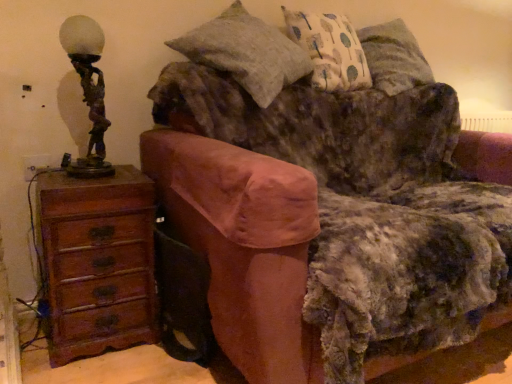
Question: From a real-world perspective, is bronze statue at left positioned over velvet brown couch at center based on gravity?

Choices:
 (A) no
 (B) yes

Answer: (B)

Question: Is bronze statue at left at the left side of velvet brown couch at center?

Choices:
 (A) no
 (B) yes

Answer: (B)

Question: Considering the relative sizes of bronze statue at left and velvet brown couch at center in the image provided, is bronze statue at left thinner than velvet brown couch at center?

Choices:
 (A) yes
 (B) no

Answer: (A)

Question: Are bronze statue at left and velvet brown couch at center located far from each other?

Choices:
 (A) no
 (B) yes

Answer: (A)

Question: Is bronze statue at left oriented towards velvet brown couch at center?

Choices:
 (A) yes
 (B) no

Answer: (B)

Question: Would you say textured gray pillow at upper center, the 2th pillow when ordered from right to left, is to the left or to the right of velvet brown couch at center in the picture?

Choices:
 (A) left
 (B) right

Answer: (A)

Question: Based on their sizes in the image, would you say textured gray pillow at upper center, the 1th pillow positioned from the left, is bigger or smaller than velvet brown couch at center?

Choices:
 (A) small
 (B) big

Answer: (A)

Question: Is point (275, 77) closer or farther from the camera than point (425, 286)?

Choices:
 (A) closer
 (B) farther

Answer: (B)

Question: From a real-world perspective, is textured gray pillow at upper center, the 1th pillow positioned from the left, positioned above or below velvet brown couch at center?

Choices:
 (A) above
 (B) below

Answer: (A)

Question: Is patterned fabric pillow at upper right, acting as the 2th pillow starting from the left, spatially inside bronze statue at left, or outside of it?

Choices:
 (A) inside
 (B) outside

Answer: (B)

Question: Based on their sizes in the image, would you say patterned fabric pillow at upper right, acting as the 2th pillow starting from the left, is bigger or smaller than bronze statue at left?

Choices:
 (A) small
 (B) big

Answer: (B)

Question: Considering the positions of patterned fabric pillow at upper right, acting as the 2th pillow starting from the left, and bronze statue at left in the image, is patterned fabric pillow at upper right, acting as the 2th pillow starting from the left, taller or shorter than bronze statue at left?

Choices:
 (A) short
 (B) tall

Answer: (B)

Question: From a real-world perspective, is patterned fabric pillow at upper right, acting as the 2th pillow starting from the left, above or below bronze statue at left?

Choices:
 (A) below
 (B) above

Answer: (B)

Question: Based on their sizes in the image, would you say bronze statue at left is bigger or smaller than velvet brown couch at center?

Choices:
 (A) big
 (B) small

Answer: (B)

Question: From a real-world perspective, is bronze statue at left physically located above or below velvet brown couch at center?

Choices:
 (A) above
 (B) below

Answer: (A)